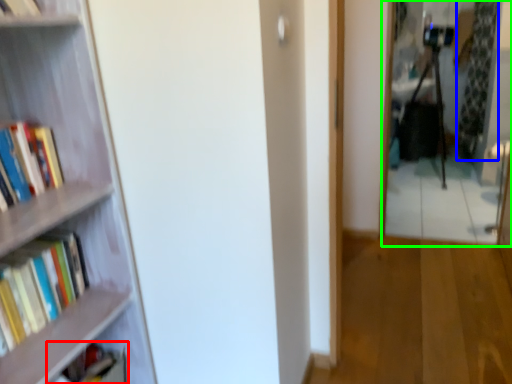
Question: Which is farther away from book (highlighted by a red box)? curtain (highlighted by a blue box) or mirror (highlighted by a green box)?

Choices:
 (A) curtain
 (B) mirror

Answer: (A)